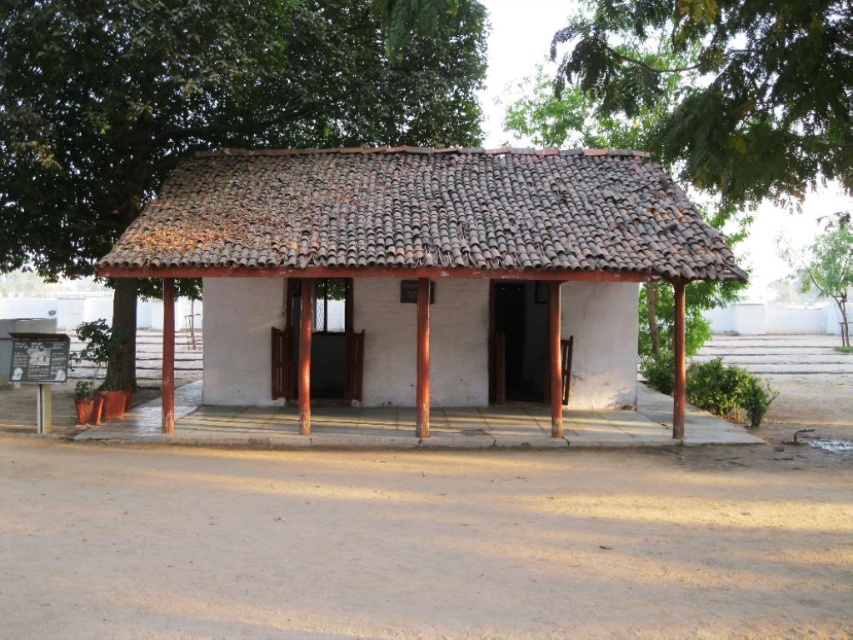
Which is above, brown sandy dirt field at center or green leafy tree at upper center?

green leafy tree at upper center is higher up.

Does point (569, 602) lie behind point (817, 163)?

That is False.

The height and width of the screenshot is (640, 853). In order to click on brown sandy dirt field at center in this screenshot , I will do [x=422, y=544].

Measure the distance from brown sandy dirt field at center to white matte hut at center.

brown sandy dirt field at center is 3.79 meters away from white matte hut at center.

Can you confirm if brown sandy dirt field at center is positioned to the right of white matte hut at center?

Indeed, brown sandy dirt field at center is positioned on the right side of white matte hut at center.

Locate an element on the screen. The height and width of the screenshot is (640, 853). brown sandy dirt field at center is located at coordinates (422, 544).

Who is lower down, white matte hut at center or green leafy tree at upper center?

white matte hut at center is below.

Based on the photo, between white matte hut at center and green leafy tree at upper center, which one appears on the left side from the viewer's perspective?

white matte hut at center

The width and height of the screenshot is (853, 640). I want to click on white matte hut at center, so click(x=422, y=218).

What are the coordinates of `white matte hut at center` in the screenshot? It's located at (422, 218).